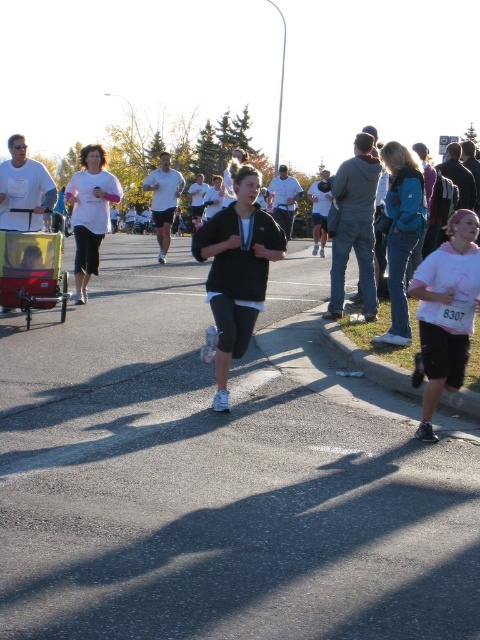
Question: Which object appears farthest from the camera in this image?

Choices:
 (A) red plastic baby carriage at left
 (B) white cotton shirt at center

Answer: (B)

Question: Does black cotton shirt at center appear on the right side of red plastic baby carriage at left?

Choices:
 (A) no
 (B) yes

Answer: (B)

Question: Can you confirm if teal fabric jacket at upper right is wider than red plastic baby carriage at left?

Choices:
 (A) no
 (B) yes

Answer: (A)

Question: Which object is the farthest from the red plastic baby carriage at left?

Choices:
 (A) white matte shirt at lower right
 (B) black matte running shoes at center
 (C) teal fabric jacket at upper right
 (D) white cotton shirt at center

Answer: (A)

Question: Is black cotton shirt at center to the right of teal fabric jacket at upper right from the viewer's perspective?

Choices:
 (A) yes
 (B) no

Answer: (B)

Question: Among these points, which one is farthest from the camera?

Choices:
 (A) (109, 394)
 (B) (216, 225)
 (C) (436, 291)
 (D) (19, 246)

Answer: (D)